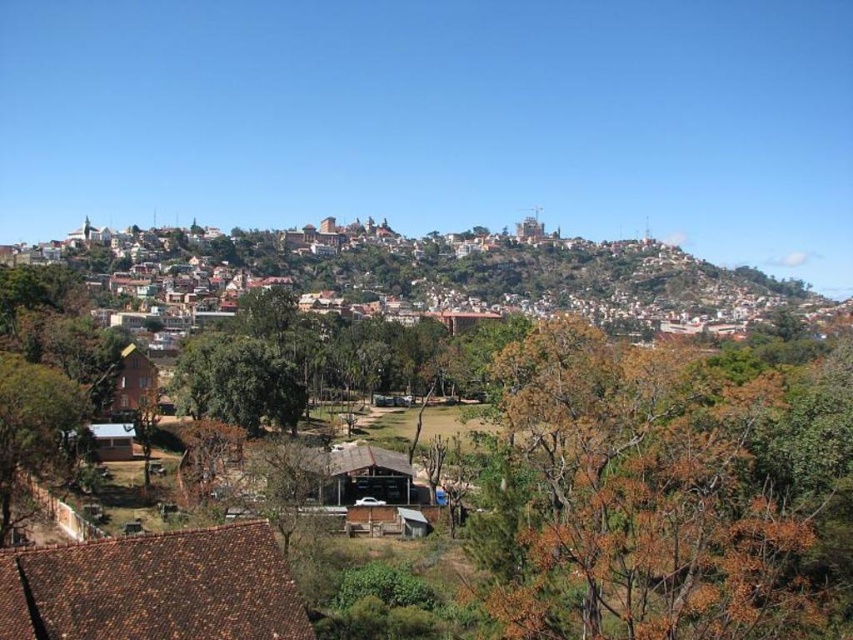
Question: Which point appears farthest from the camera in this image?

Choices:
 (A) (509, 262)
 (B) (341, 492)
 (C) (149, 611)
 (D) (646, 435)

Answer: (A)

Question: Which point is farther to the camera?

Choices:
 (A) brown wooden houses at center
 (B) brown wooden hut at lower left

Answer: (A)

Question: Which object is farther from the camera taking this photo?

Choices:
 (A) green leafy tree at center
 (B) brown leafy tree at lower right
 (C) brown thatched hut at center

Answer: (A)

Question: Does green leafy tree at center appear on the left side of brown thatched hut at center?

Choices:
 (A) no
 (B) yes

Answer: (B)

Question: Is brown wooden houses at center smaller than brown tile roof at lower left?

Choices:
 (A) yes
 (B) no

Answer: (B)

Question: Does brown wooden houses at center have a larger size compared to green leafy tree at lower left?

Choices:
 (A) yes
 (B) no

Answer: (A)